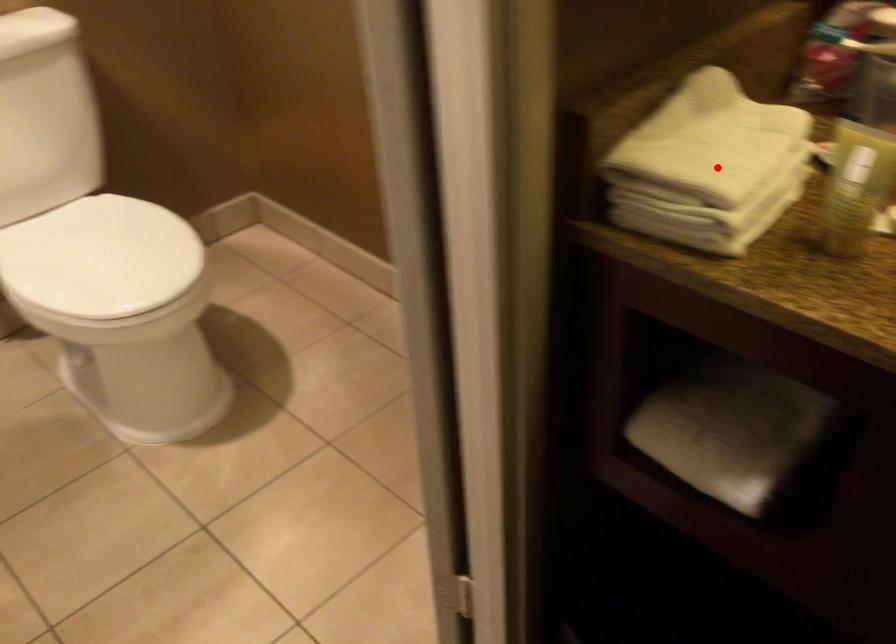
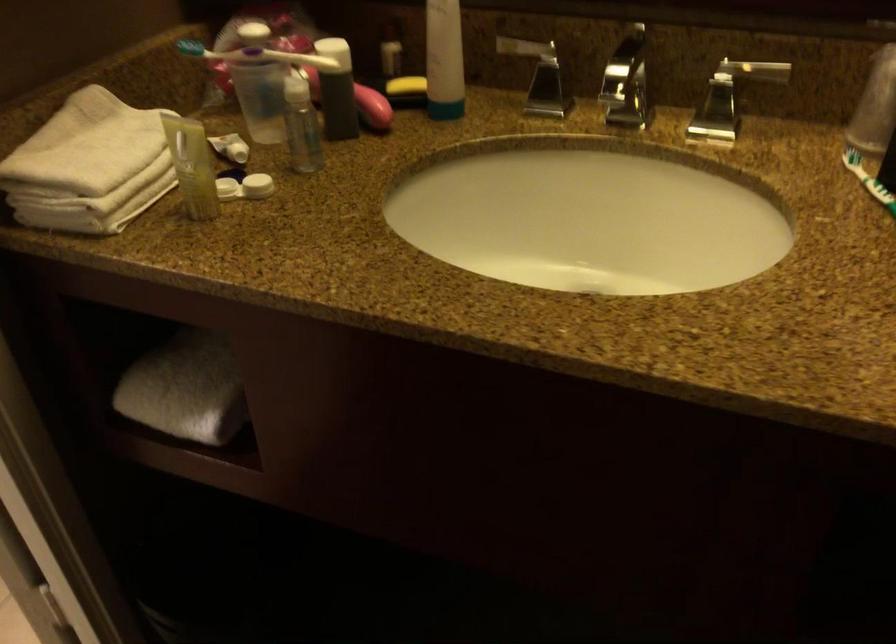
The point at the highlighted location is marked in the first image. Where is the corresponding point in the second image?

(89, 166)